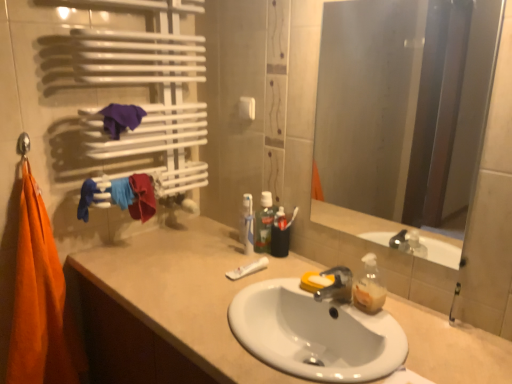
Question: Is beige matte cabinet at lower left surrounding green translucent mouthwash at center?

Choices:
 (A) yes
 (B) no

Answer: (B)

Question: Considering the relative sizes of beige matte cabinet at lower left and green translucent mouthwash at center in the image provided, is beige matte cabinet at lower left smaller than green translucent mouthwash at center?

Choices:
 (A) no
 (B) yes

Answer: (A)

Question: Can you confirm if beige matte cabinet at lower left is bigger than green translucent mouthwash at center?

Choices:
 (A) no
 (B) yes

Answer: (B)

Question: Is beige matte cabinet at lower left positioned with its back to green translucent mouthwash at center?

Choices:
 (A) yes
 (B) no

Answer: (B)

Question: Can you confirm if beige matte cabinet at lower left is positioned to the left of green translucent mouthwash at center?

Choices:
 (A) yes
 (B) no

Answer: (A)

Question: From their relative heights in the image, would you say white ceramic sink at center is taller or shorter than green translucent mouthwash at center?

Choices:
 (A) short
 (B) tall

Answer: (A)

Question: Considering the relative positions of white ceramic sink at center and green translucent mouthwash at center in the image provided, is white ceramic sink at center to the left or to the right of green translucent mouthwash at center?

Choices:
 (A) right
 (B) left

Answer: (A)

Question: Is white ceramic sink at center bigger or smaller than green translucent mouthwash at center?

Choices:
 (A) big
 (B) small

Answer: (A)

Question: Considering the positions of white ceramic sink at center and green translucent mouthwash at center in the image, is white ceramic sink at center wider or thinner than green translucent mouthwash at center?

Choices:
 (A) thin
 (B) wide

Answer: (B)

Question: In terms of width, does beige matte cabinet at lower left look wider or thinner when compared to smooth glass mirror at center?

Choices:
 (A) thin
 (B) wide

Answer: (B)

Question: From a real-world perspective, is beige matte cabinet at lower left positioned above or below smooth glass mirror at center?

Choices:
 (A) above
 (B) below

Answer: (B)

Question: Is beige matte cabinet at lower left inside or outside of smooth glass mirror at center?

Choices:
 (A) inside
 (B) outside

Answer: (B)

Question: Is beige matte cabinet at lower left to the left or to the right of smooth glass mirror at center in the image?

Choices:
 (A) right
 (B) left

Answer: (B)

Question: Considering the positions of smooth glass mirror at center and green translucent mouthwash at center in the image, is smooth glass mirror at center wider or thinner than green translucent mouthwash at center?

Choices:
 (A) thin
 (B) wide

Answer: (A)

Question: From a real-world perspective, is smooth glass mirror at center physically located above or below green translucent mouthwash at center?

Choices:
 (A) above
 (B) below

Answer: (A)